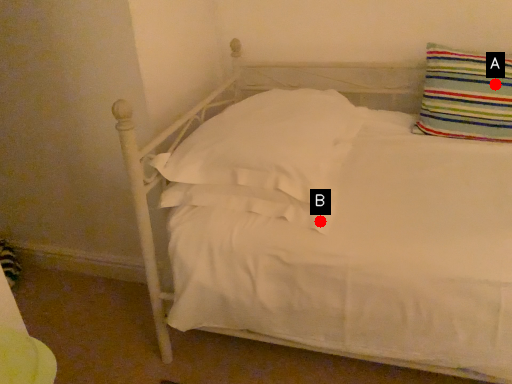
Question: Two points are circled on the image, labeled by A and B beside each circle. Which point is closer to the camera taking this photo?

Choices:
 (A) A is closer
 (B) B is closer

Answer: (B)